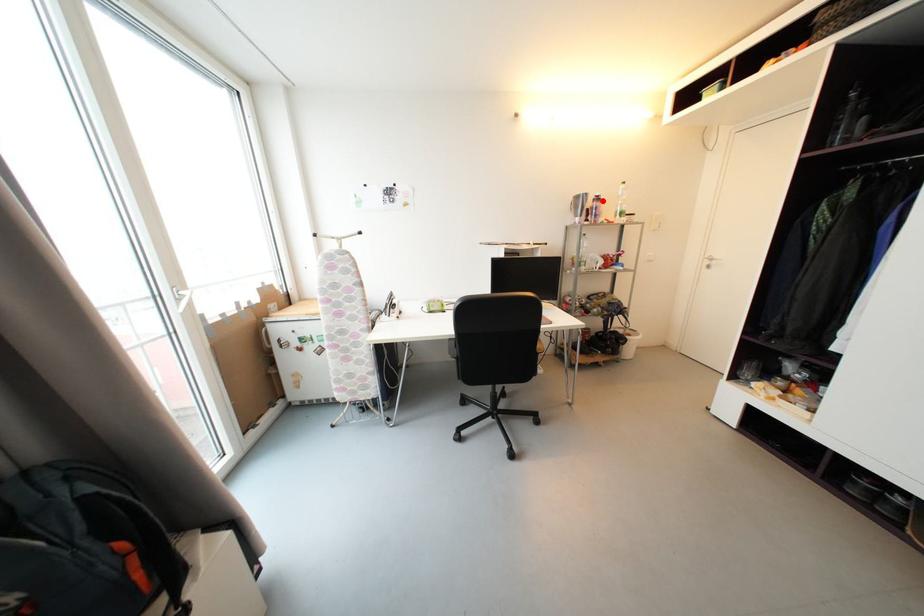
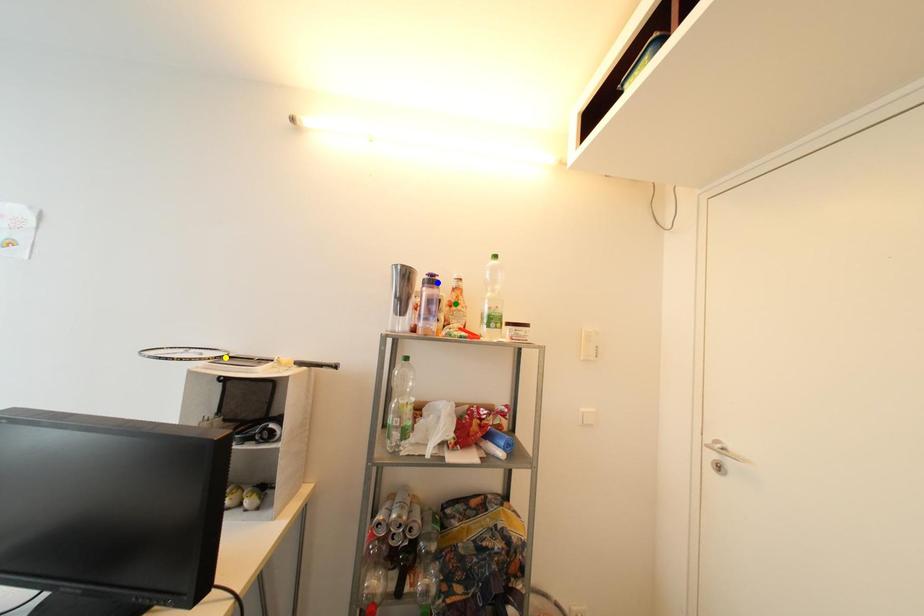
Question: I am providing you with two images of the same scene from different viewpoints. A red point is marked on the first image. You are given multiple points on the second image. Which point in image 2 is actually the same real-world point as the red point in image 1?

Choices:
 (A) green point
 (B) yellow point
 (C) blue point

Answer: (C)